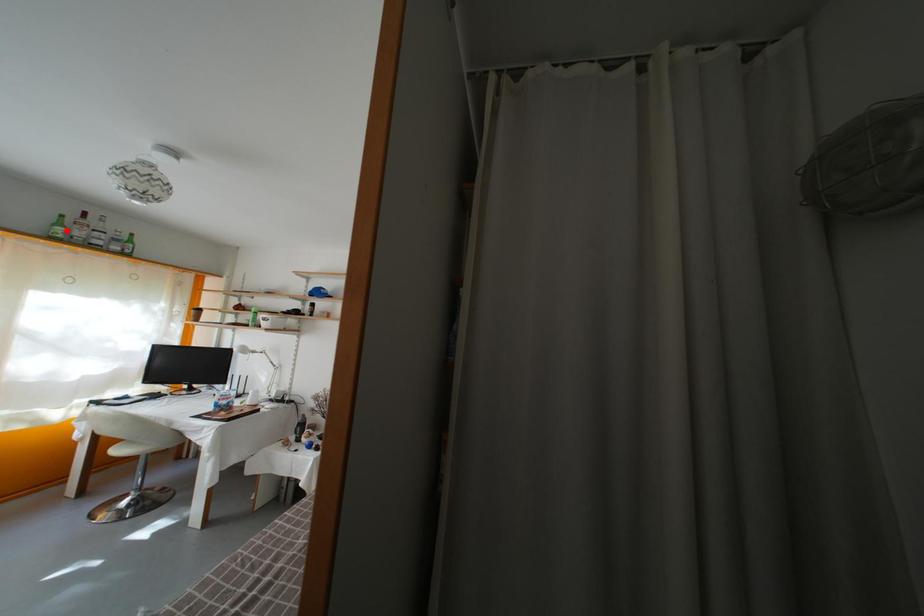
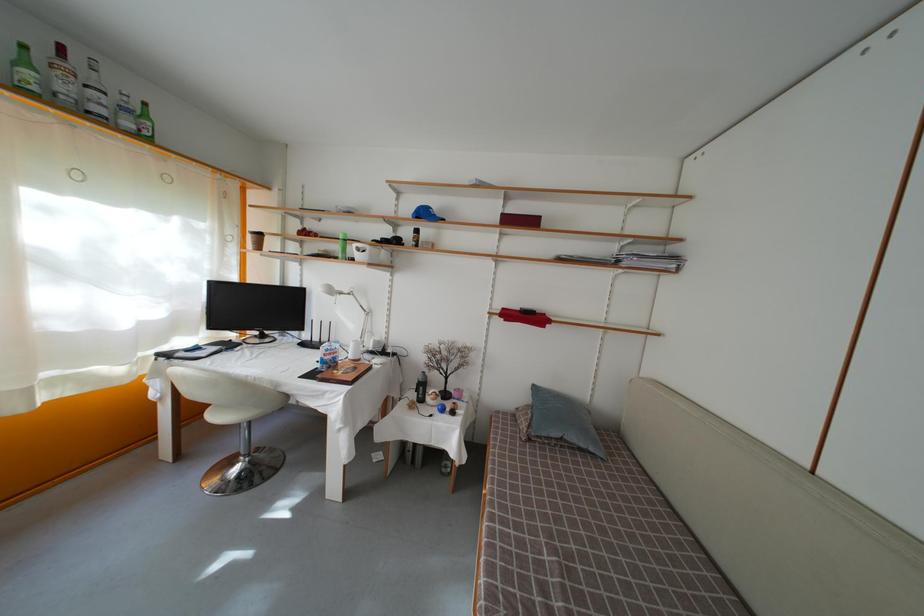
The point at the highlighted location is marked in the first image. Where is the corresponding point in the second image?

(31, 69)